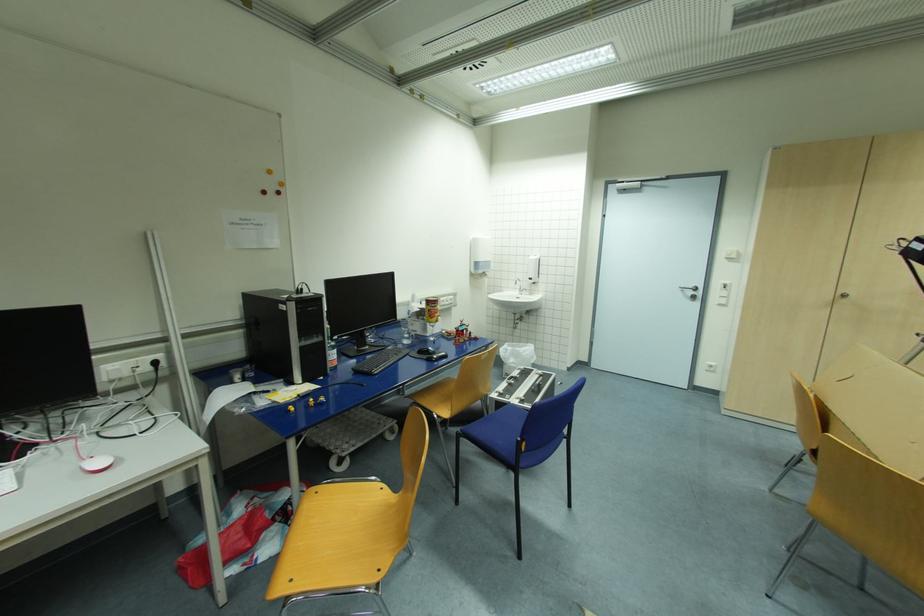
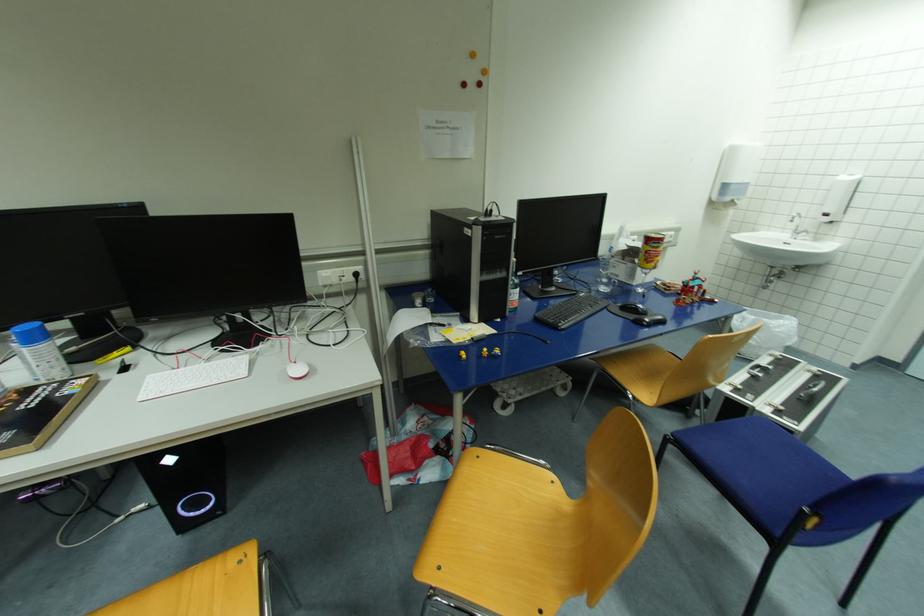
The point at (465,329) is marked in the first image. Where is the corresponding point in the second image?

(696, 285)